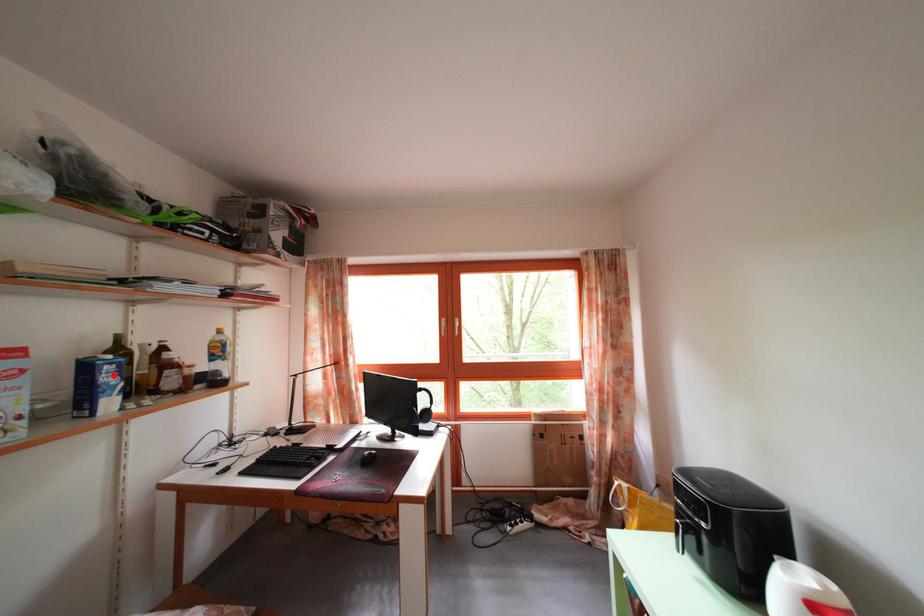
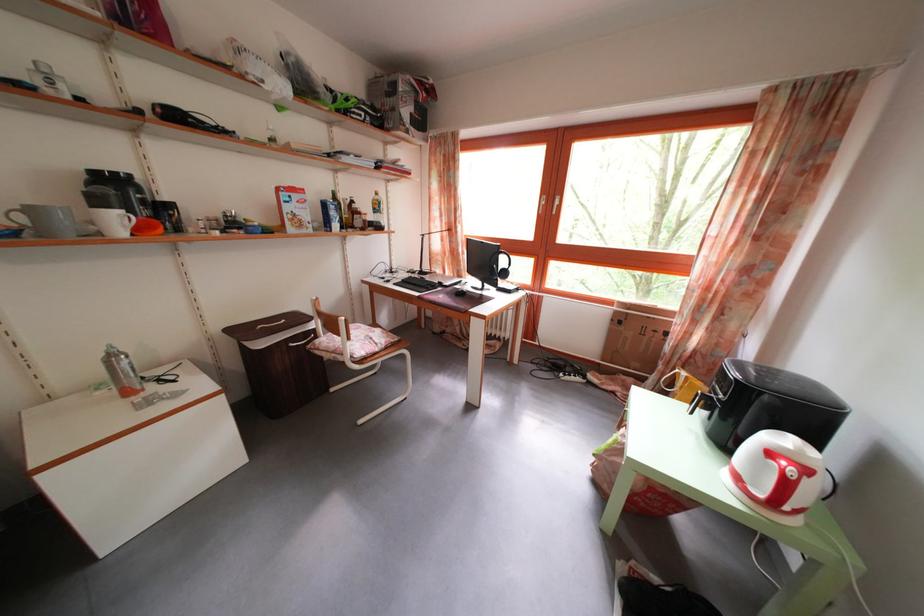
Find the pixel in the second image that matches the highlighted location in the first image.

(338, 214)